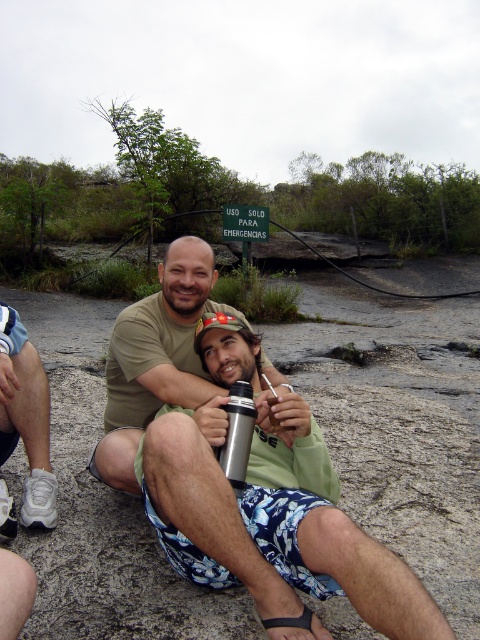
Question: Which of the following is the farthest from the observer?

Choices:
 (A) matte green t-shirt at center
 (B) silver metallic thermos at center

Answer: (A)

Question: Can you confirm if metallic silver thermos at center is bigger than matte green t-shirt at center?

Choices:
 (A) no
 (B) yes

Answer: (A)

Question: Can you confirm if matte green t-shirt at center is positioned above silver metallic thermos at center?

Choices:
 (A) yes
 (B) no

Answer: (A)

Question: Does matte green t-shirt at center appear under white matte shoe at lower left?

Choices:
 (A) yes
 (B) no

Answer: (B)

Question: Among these objects, which one is farthest from the camera?

Choices:
 (A) matte green t-shirt at center
 (B) white matte shoe at lower left
 (C) metallic silver thermos at center
 (D) silver metallic thermos at center

Answer: (A)

Question: Estimate the real-world distances between objects in this image. Which object is closer to the metallic silver thermos at center?

Choices:
 (A) matte green t-shirt at center
 (B) white matte shoe at lower left

Answer: (A)